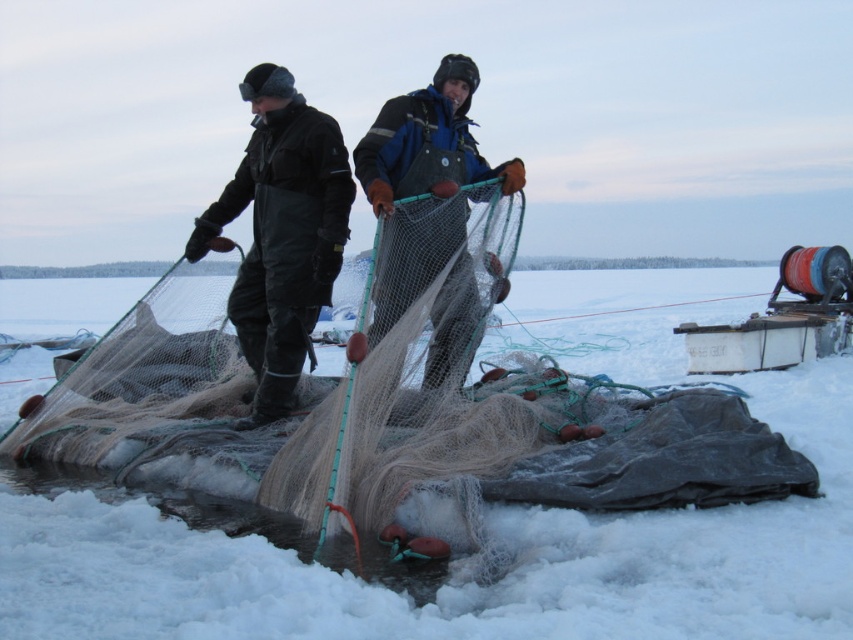
You are navigating a drone over the frozen lake and need to drop a supply package to the person wearing the dark green waterproof overalls at center. According to the coordinates provided, where should you aim the drop?

The dark green waterproof overalls at center is located at point (281, 232), so you should aim the drone drop at coordinates (281, 232) to reach the person wearing the dark green waterproof overalls at center.

You are an observer standing on the edge of the frozen lake. You see the white fluffy snow at center and the blue fabric net at center. Which object is closer to the bottom of the lake?

The blue fabric net at center is closer to the bottom of the lake because the white fluffy snow at center is below it.